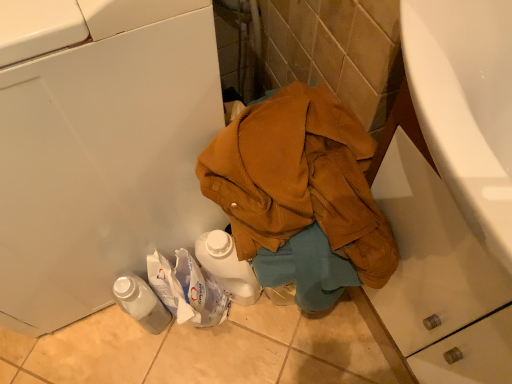
Question: Does translucent plastic bottle at lower left lie in front of white plastic washing machine at lower left?

Choices:
 (A) yes
 (B) no

Answer: (B)

Question: From a real-world perspective, is translucent plastic bottle at lower left beneath white plastic washing machine at lower left?

Choices:
 (A) yes
 (B) no

Answer: (A)

Question: Considering the relative sizes of translucent plastic bottle at lower left and white plastic washing machine at lower left in the image provided, is translucent plastic bottle at lower left taller than white plastic washing machine at lower left?

Choices:
 (A) no
 (B) yes

Answer: (A)

Question: Would you consider translucent plastic bottle at lower left to be distant from white plastic washing machine at lower left?

Choices:
 (A) yes
 (B) no

Answer: (B)

Question: Does translucent plastic bottle at lower left have a lesser height compared to white plastic washing machine at lower left?

Choices:
 (A) no
 (B) yes

Answer: (B)

Question: From the image's perspective, is translucent plastic bottle at lower left beneath white plastic washing machine at lower left?

Choices:
 (A) yes
 (B) no

Answer: (A)

Question: Is white plastic washing machine at lower left aimed at brown corduroy jacket at center?

Choices:
 (A) no
 (B) yes

Answer: (A)

Question: From the image's perspective, is white plastic washing machine at lower left over brown corduroy jacket at center?

Choices:
 (A) yes
 (B) no

Answer: (A)

Question: From a real-world perspective, is white plastic washing machine at lower left positioned over brown corduroy jacket at center based on gravity?

Choices:
 (A) yes
 (B) no

Answer: (A)

Question: Are white plastic washing machine at lower left and brown corduroy jacket at center located far from each other?

Choices:
 (A) no
 (B) yes

Answer: (A)

Question: Is white plastic washing machine at lower left at the right side of brown corduroy jacket at center?

Choices:
 (A) no
 (B) yes

Answer: (A)

Question: Does white plastic washing machine at lower left have a lesser width compared to brown corduroy jacket at center?

Choices:
 (A) no
 (B) yes

Answer: (A)

Question: Is brown corduroy jacket at center outside translucent plastic bottle at lower left?

Choices:
 (A) yes
 (B) no

Answer: (A)